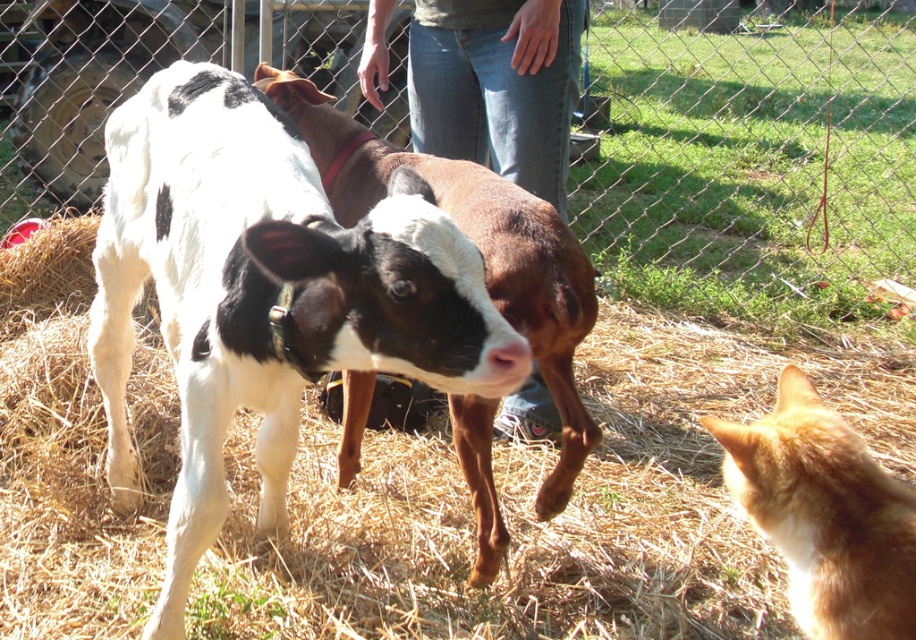
How much distance is there between black and white cow at center and jeans at center?

They are 1.17 meters apart.

Can you confirm if black and white cow at center is bigger than jeans at center?

Indeed, black and white cow at center has a larger size compared to jeans at center.

Consider the image. Who is more forward, [140,244] or [469,140]?

Point [140,244] is in front.

Find the location of `black and white cow at center`. black and white cow at center is located at coordinates (264, 292).

Who is positioned more to the right, brown straw at center or jeans at center?

brown straw at center is more to the right.

How much distance is there between brown straw at center and jeans at center?

The distance of brown straw at center from jeans at center is 1.14 meters.

Is point (322, 598) closer to viewer compared to point (553, 200)?

Yes, point (322, 598) is in front of point (553, 200).

Where is `brown straw at center`? This screenshot has width=916, height=640. brown straw at center is located at coordinates click(x=557, y=515).

Who is taller, wire mesh fence at center or black and white cow at center?

wire mesh fence at center is taller.

Which is below, wire mesh fence at center or black and white cow at center?

black and white cow at center is lower down.

Does point (843, 156) come in front of point (176, 250)?

No, (843, 156) is behind (176, 250).

Identify the location of wire mesh fence at center. The width and height of the screenshot is (916, 640). (747, 154).